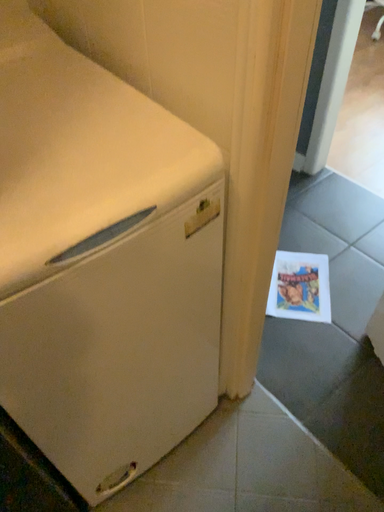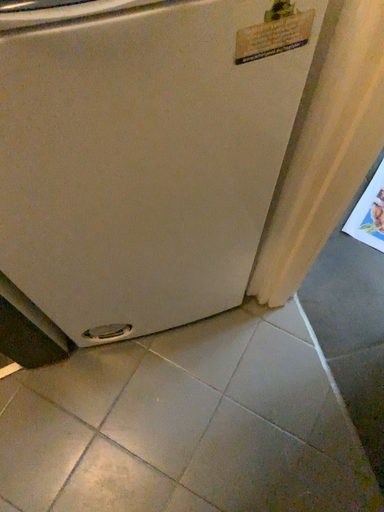
Question: Which way did the camera rotate in the video?

Choices:
 (A) rotated right
 (B) rotated left

Answer: (B)